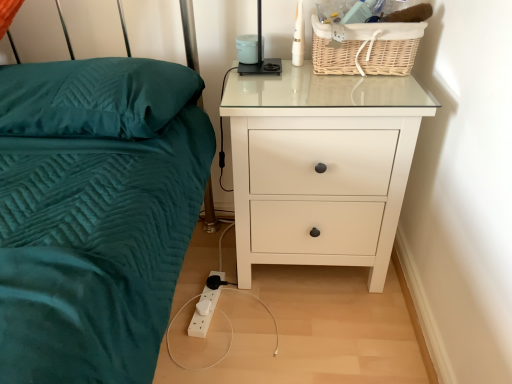
Question: Is woven natural basket at upper right to the left of teal quilted pillow at left from the viewer's perspective?

Choices:
 (A) yes
 (B) no

Answer: (B)

Question: Is woven natural basket at upper right thinner than teal quilted pillow at left?

Choices:
 (A) yes
 (B) no

Answer: (A)

Question: Is woven natural basket at upper right in contact with teal quilted pillow at left?

Choices:
 (A) no
 (B) yes

Answer: (A)

Question: From the image's perspective, does woven natural basket at upper right appear lower than teal quilted pillow at left?

Choices:
 (A) no
 (B) yes

Answer: (A)

Question: Would you say teal quilted pillow at left is part of woven natural basket at upper right's contents?

Choices:
 (A) yes
 (B) no

Answer: (B)

Question: Is woven natural basket at upper right facing towards teal quilted pillow at left?

Choices:
 (A) no
 (B) yes

Answer: (A)

Question: Is woven natural basket at upper right located within black plastic lamp at upper center?

Choices:
 (A) yes
 (B) no

Answer: (B)

Question: Is black plastic lamp at upper center positioned far away from woven natural basket at upper right?

Choices:
 (A) yes
 (B) no

Answer: (B)

Question: Could you tell me if black plastic lamp at upper center is turned towards woven natural basket at upper right?

Choices:
 (A) no
 (B) yes

Answer: (A)

Question: Does black plastic lamp at upper center have a greater width compared to woven natural basket at upper right?

Choices:
 (A) yes
 (B) no

Answer: (B)

Question: From a real-world perspective, does black plastic lamp at upper center sit lower than woven natural basket at upper right?

Choices:
 (A) no
 (B) yes

Answer: (B)

Question: Considering the relative sizes of black plastic lamp at upper center and woven natural basket at upper right in the image provided, is black plastic lamp at upper center smaller than woven natural basket at upper right?

Choices:
 (A) no
 (B) yes

Answer: (B)

Question: Is white glossy chest of drawers at right facing towards black plastic lamp at upper center?

Choices:
 (A) yes
 (B) no

Answer: (B)